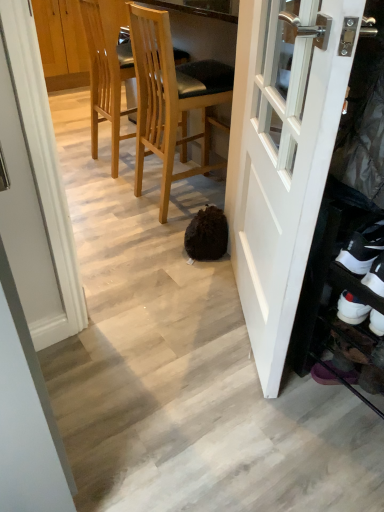
Where is `white suede shoe at lower right, acting as the 2th shoe starting from the front`? The height and width of the screenshot is (512, 384). white suede shoe at lower right, acting as the 2th shoe starting from the front is located at coordinates (375, 277).

This screenshot has width=384, height=512. What do you see at coordinates (375, 277) in the screenshot? I see `white suede shoe at lower right, placed as the first shoe when sorted from back to front` at bounding box center [375, 277].

Image resolution: width=384 pixels, height=512 pixels. What do you see at coordinates (281, 161) in the screenshot?
I see `white glossy door at right` at bounding box center [281, 161].

Measure the distance between point (351, 253) and camera.

They are 3.39 feet apart.

At what (x,y) coordinates should I click in order to perform the action: click on light brown wood chair at center, the 1th chair in the left-to-right sequence. Please return your answer as a coordinate pair (x, y). Looking at the image, I should click on (107, 69).

Which object is positioned more to the right, white suede shoe at lower right, marked as the second shoe in a back-to-front arrangement, or light brown wood chair at center, the 1th chair in the left-to-right sequence?

white suede shoe at lower right, marked as the second shoe in a back-to-front arrangement, is more to the right.

In the scene shown: Is white suede shoe at lower right, marked as the second shoe in a back-to-front arrangement, thinner than light brown wood chair at center, the 1th chair in the left-to-right sequence?

Yes.

From a real-world perspective, is white suede shoe at lower right, marked as the second shoe in a back-to-front arrangement, positioned under light brown wood chair at center, which ranks as the 2th chair in right-to-left order, based on gravity?

No, from a real-world perspective, white suede shoe at lower right, marked as the second shoe in a back-to-front arrangement, is not below light brown wood chair at center, which ranks as the 2th chair in right-to-left order.

Is light brown wood chair at center, acting as the second chair starting from the left, positioned beyond the bounds of white suede shoe at lower right, marked as the first shoe in a front-to-back arrangement?

light brown wood chair at center, acting as the second chair starting from the left, is positioned outside white suede shoe at lower right, marked as the first shoe in a front-to-back arrangement.

Is point (139, 73) in front of point (342, 259)?

No, it is behind (342, 259).

Does light brown wood chair at center, which is counted as the 1th chair, starting from the right, have a lesser height compared to white suede shoe at lower right, marked as the second shoe in a back-to-front arrangement?

In fact, light brown wood chair at center, which is counted as the 1th chair, starting from the right, may be taller than white suede shoe at lower right, marked as the second shoe in a back-to-front arrangement.

Between light brown wood chair at center, acting as the second chair starting from the left, and white suede shoe at lower right, marked as the first shoe in a front-to-back arrangement, which one appears on the right side from the viewer's perspective?

white suede shoe at lower right, marked as the first shoe in a front-to-back arrangement.

Considering the positions of objects white glossy door at right and light brown wood chair at center, the 1th chair in the left-to-right sequence, in the image provided, who is in front, white glossy door at right or light brown wood chair at center, the 1th chair in the left-to-right sequence,?

white glossy door at right is closer to the camera.

Is point (277, 121) more distant than point (121, 73)?

That is False.

From the white glossy door at right, count 2nd chairs backward and point to it. Please provide its 2D coordinates.

[(107, 69)]

Between white glossy door at right and light brown wood chair at center, which ranks as the 2th chair in right-to-left order, which one has smaller width?

white glossy door at right is thinner.

There is a white suede shoe at lower right, acting as the 2th shoe starting from the front. In order to click on door above it (from a real-world perspective) in this screenshot , I will do `click(281, 161)`.

Is white suede shoe at lower right, placed as the first shoe when sorted from back to front, oriented away from white glossy door at right?

No, white suede shoe at lower right, placed as the first shoe when sorted from back to front, is not facing the opposite direction of white glossy door at right.

How many degrees apart are the facing directions of white suede shoe at lower right, placed as the first shoe when sorted from back to front, and white glossy door at right?

There is a 43.7-degree angle between the facing directions of white suede shoe at lower right, placed as the first shoe when sorted from back to front, and white glossy door at right.

Does point (340, 308) come in front of point (269, 245)?

Yes, it is.

Is light brown wood chair at center, which ranks as the 2th chair in right-to-left order, touching light brown wood chair at center, acting as the second chair starting from the left?

No, light brown wood chair at center, which ranks as the 2th chair in right-to-left order, is not beside light brown wood chair at center, acting as the second chair starting from the left.

From a real-world perspective, which object stands above the other?

From a 3D spatial view, light brown wood chair at center, which is counted as the 1th chair, starting from the right, is above.

Looking at this image, which object is further away from the camera taking this photo, light brown wood chair at center, which ranks as the 2th chair in right-to-left order, or light brown wood chair at center, acting as the second chair starting from the left?

light brown wood chair at center, which ranks as the 2th chair in right-to-left order, is further away from the camera.

Is light brown wood chair at center, which ranks as the 2th chair in right-to-left order, smaller than light brown wood chair at center, which is counted as the 1th chair, starting from the right?

Correct, light brown wood chair at center, which ranks as the 2th chair in right-to-left order, occupies less space than light brown wood chair at center, which is counted as the 1th chair, starting from the right.

Considering the points (139, 168) and (263, 254), which point is in front, point (139, 168) or point (263, 254)?

Positioned in front is point (263, 254).

Locate an element on the screen. the 1st chair behind when counting from the white glossy door at right is located at coordinates (171, 99).

From the image's perspective, who appears lower, light brown wood chair at center, which is counted as the 1th chair, starting from the right, or white glossy door at right?

white glossy door at right is shown below in the image.

Is light brown wood chair at center, acting as the second chair starting from the left, facing towards white glossy door at right?

No, light brown wood chair at center, acting as the second chair starting from the left, is not oriented towards white glossy door at right.

Is light brown wood chair at center, which ranks as the 2th chair in right-to-left order, wider or thinner than white suede shoe at lower right, acting as the 2th shoe starting from the front?

In the image, light brown wood chair at center, which ranks as the 2th chair in right-to-left order, appears to be wider than white suede shoe at lower right, acting as the 2th shoe starting from the front.

Based on their sizes in the image, would you say light brown wood chair at center, the 1th chair in the left-to-right sequence, is bigger or smaller than white suede shoe at lower right, acting as the 2th shoe starting from the front?

In the image, light brown wood chair at center, the 1th chair in the left-to-right sequence, appears to be larger than white suede shoe at lower right, acting as the 2th shoe starting from the front.

Is light brown wood chair at center, the 1th chair in the left-to-right sequence, shorter than white suede shoe at lower right, placed as the first shoe when sorted from back to front?

No, light brown wood chair at center, the 1th chair in the left-to-right sequence, is not shorter than white suede shoe at lower right, placed as the first shoe when sorted from back to front.

Is light brown wood chair at center, which ranks as the 2th chair in right-to-left order, further to the viewer compared to white suede shoe at lower right, acting as the 2th shoe starting from the front?

Yes.

What are the coordinates of `shoe above the light brown wood chair at center, the 1th chair in the left-to-right sequence (from a real-world perspective)` in the screenshot? It's located at (363, 246).

From a real-world perspective, starting from the white suede shoe at lower right, marked as the first shoe in a front-to-back arrangement, which chair is the 1st one below it? Please provide its 2D coordinates.

[(171, 99)]

From the image, which object appears to be farther from white glossy door at right, white suede shoe at lower right, marked as the second shoe in a back-to-front arrangement, or light brown wood chair at center, the 1th chair in the left-to-right sequence?

light brown wood chair at center, the 1th chair in the left-to-right sequence.

When comparing their distances from light brown wood chair at center, the 1th chair in the left-to-right sequence, does white suede shoe at lower right, marked as the second shoe in a back-to-front arrangement, or white glossy door at right seem closer?

The object closer to light brown wood chair at center, the 1th chair in the left-to-right sequence, is white glossy door at right.

Estimate the real-world distances between objects in this image. Which object is further from light brown wood chair at center, the 1th chair in the left-to-right sequence, white glossy door at right or white suede shoe at lower right, acting as the 2th shoe starting from the front?

white suede shoe at lower right, acting as the 2th shoe starting from the front, lies further to light brown wood chair at center, the 1th chair in the left-to-right sequence, than the other object.

Based on the photo, which object lies further to the anchor point white glossy door at right, white suede shoe at lower right, acting as the 2th shoe starting from the front, or light brown wood chair at center, the 1th chair in the left-to-right sequence?

light brown wood chair at center, the 1th chair in the left-to-right sequence, is positioned further to the anchor white glossy door at right.

Looking at the image, which one is located further to light brown wood chair at center, which is counted as the 1th chair, starting from the right, white suede shoe at lower right, placed as the first shoe when sorted from back to front, or white glossy door at right?

Among the two, white suede shoe at lower right, placed as the first shoe when sorted from back to front, is located further to light brown wood chair at center, which is counted as the 1th chair, starting from the right.

Looking at the image, which one is located closer to white suede shoe at lower right, placed as the first shoe when sorted from back to front, white glossy door at right or light brown wood chair at center, which is counted as the 1th chair, starting from the right?

Based on the image, white glossy door at right appears to be nearer to white suede shoe at lower right, placed as the first shoe when sorted from back to front.

When comparing their distances from white suede shoe at lower right, acting as the 2th shoe starting from the front, does white glossy door at right or white suede shoe at lower right, marked as the second shoe in a back-to-front arrangement, seem further?

white glossy door at right is positioned further to the anchor white suede shoe at lower right, acting as the 2th shoe starting from the front.

Considering their positions, is white suede shoe at lower right, marked as the first shoe in a front-to-back arrangement, positioned closer to light brown wood chair at center, which is counted as the 1th chair, starting from the right, than white glossy door at right?

Among the two, white glossy door at right is located nearer to light brown wood chair at center, which is counted as the 1th chair, starting from the right.

The image size is (384, 512). What are the coordinates of `chair between white suede shoe at lower right, marked as the first shoe in a front-to-back arrangement, and light brown wood chair at center, the 1th chair in the left-to-right sequence, from front to back` in the screenshot? It's located at (171, 99).

You are a GUI agent. You are given a task and a screenshot of the screen. Output one action in this format:
    pyautogui.click(x=<x>, y=<y>)
    Task: Click on the chair positioned between white glossy door at right and light brown wood chair at center, which ranks as the 2th chair in right-to-left order, from near to far
    The image size is (384, 512).
    Given the screenshot: What is the action you would take?
    pyautogui.click(x=171, y=99)

Locate an element on the screen. This screenshot has height=512, width=384. shoe between light brown wood chair at center, the 1th chair in the left-to-right sequence, and white suede shoe at lower right, placed as the first shoe when sorted from back to front, in the up-down direction is located at coordinates (363, 246).

Locate an element on the screen. The image size is (384, 512). chair between light brown wood chair at center, the 1th chair in the left-to-right sequence, and white suede shoe at lower right, placed as the first shoe when sorted from back to front, in the vertical direction is located at coordinates (171, 99).